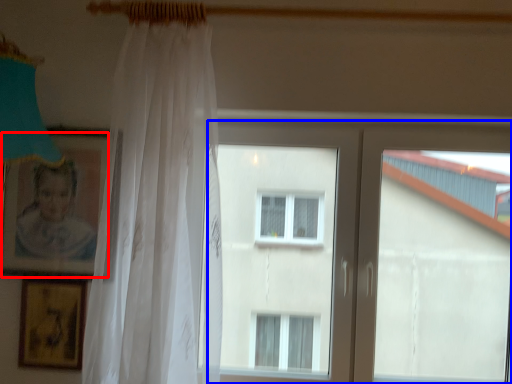
Question: Which point is closer to the camera, picture frame (highlighted by a red box) or window (highlighted by a blue box)?

Choices:
 (A) picture frame
 (B) window

Answer: (A)